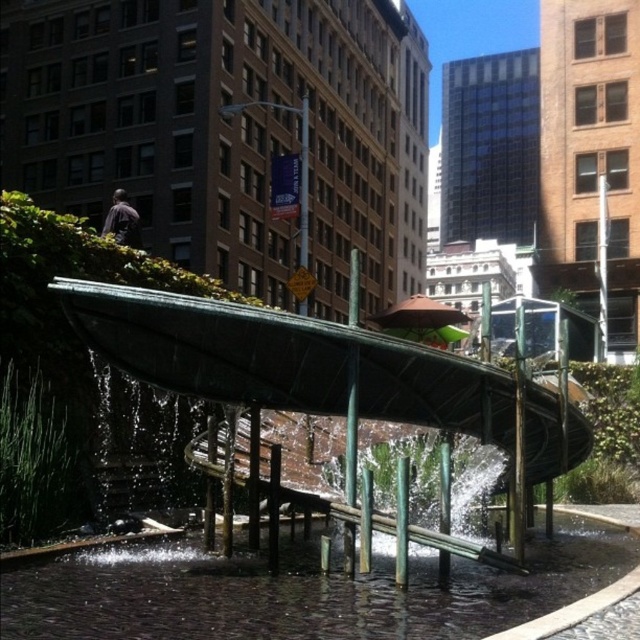
You are a visitor standing in the urban park and want to know which object is taller between the clear water at center and the green metallic water feature at center. Can you tell me which one is taller?

The clear water at center is not as tall as the green metallic water feature at center, so the green metallic water feature at center is taller.

You are a park visitor trying to decide where to place your picnic blanket. You see the clear water at center and the green metallic water feature at center. Which area has a narrower width between them?

The clear water at center is thinner than the green metallic water feature at center, so the clear water at center has a narrower width between them.